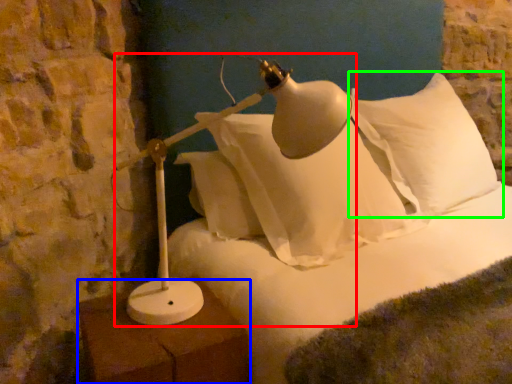
Question: Based on their relative distances, which object is farther from lamp (highlighted by a red box)? Choose from furniture (highlighted by a blue box) and pillow (highlighted by a green box).

Choices:
 (A) furniture
 (B) pillow

Answer: (B)